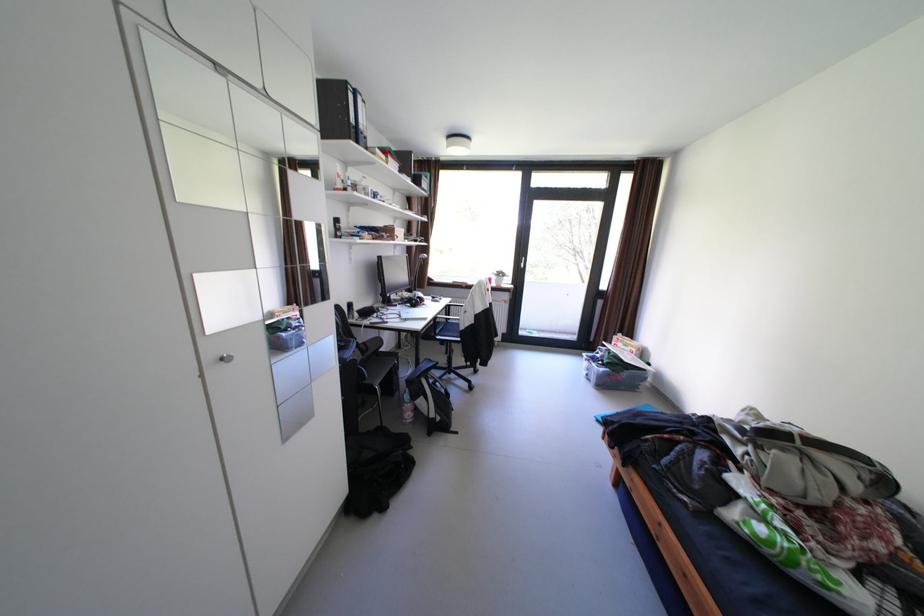
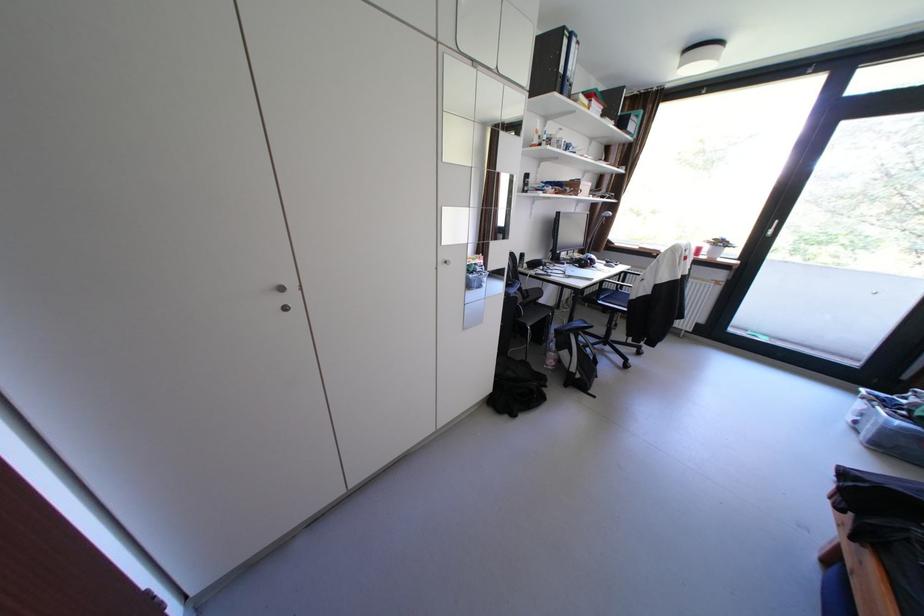
The point at (407, 429) is marked in the first image. Where is the corresponding point in the second image?

(546, 368)